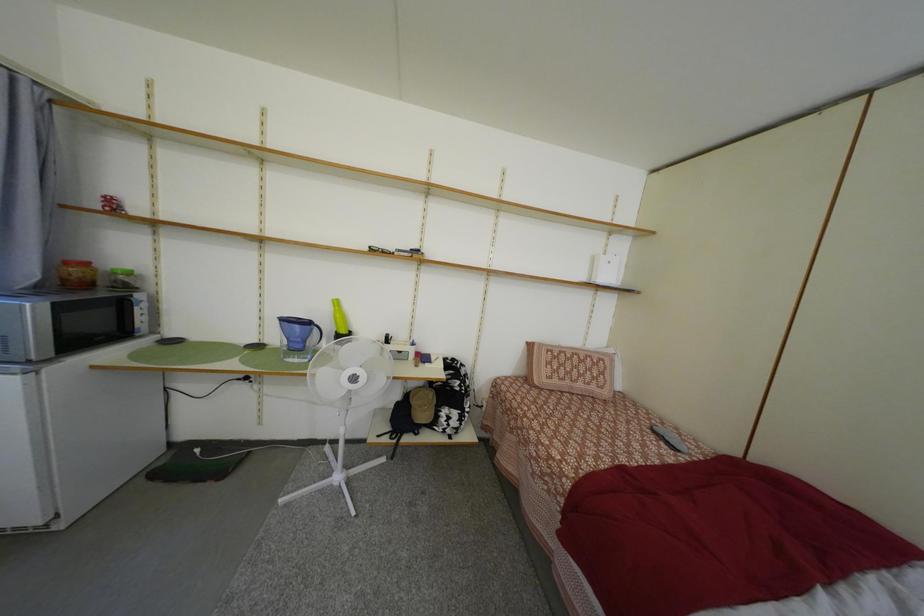
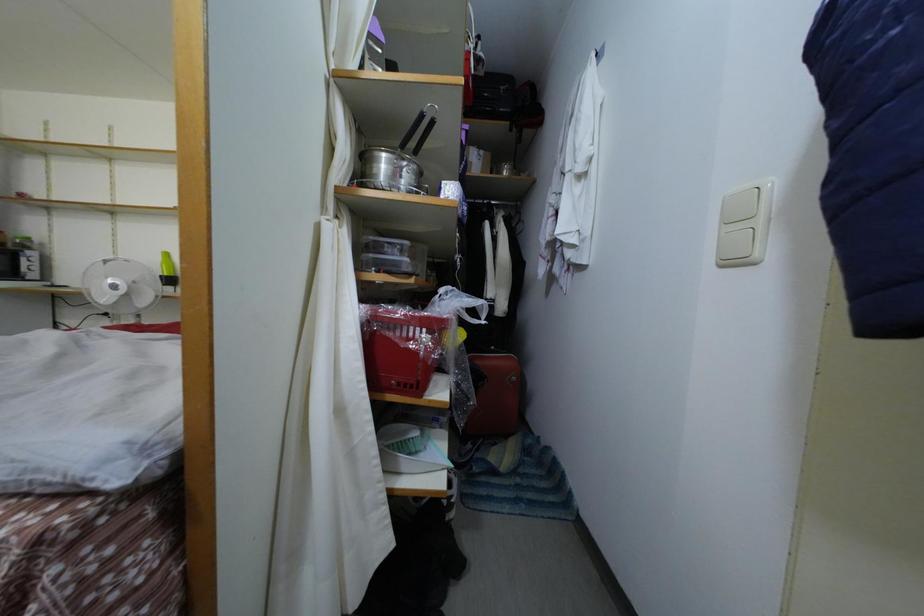
Question: The images are taken continuously from a first-person perspective. In which direction are you moving?

Choices:
 (A) Left
 (B) Right
 (C) Forward
 (D) Backward

Answer: (B)